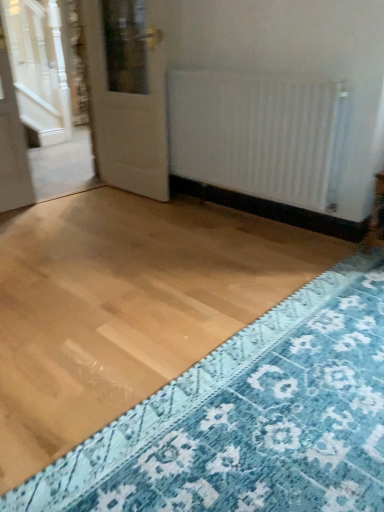
Find the location of `blank space situated above blue textured rug at lower right (from a real-world perspective)`. blank space situated above blue textured rug at lower right (from a real-world perspective) is located at coordinates (278, 416).